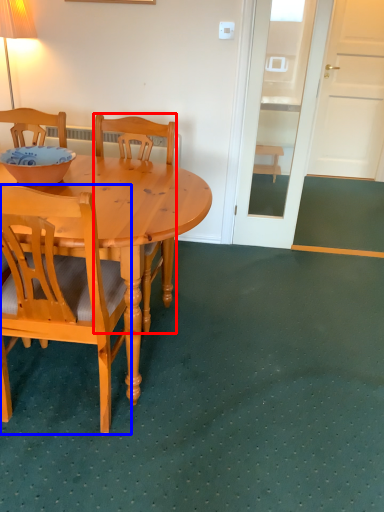
Question: Which object is closer to the camera taking this photo, chair (highlighted by a red box) or chair (highlighted by a blue box)?

Choices:
 (A) chair
 (B) chair

Answer: (B)